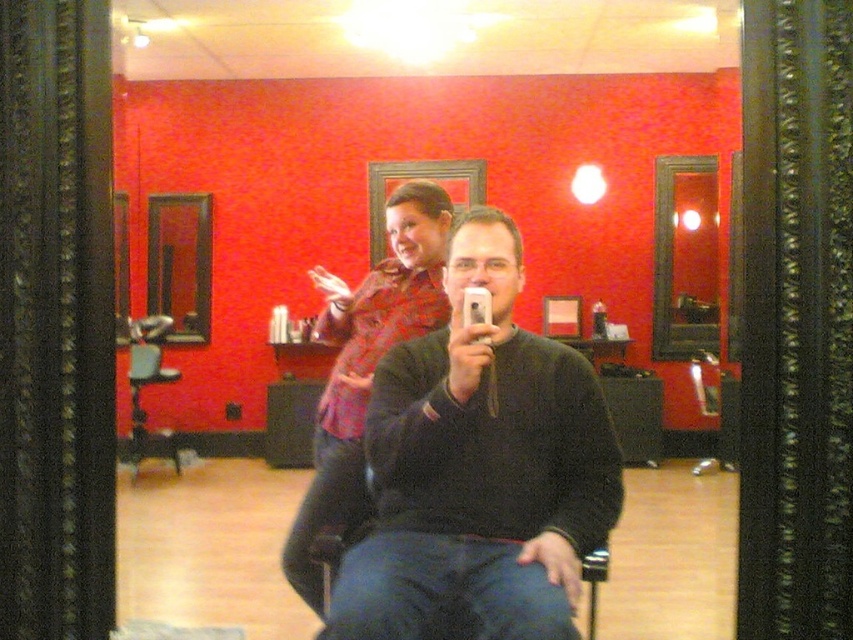
Question: Which object is closer to the camera taking this photo?

Choices:
 (A) matte black mirror at upper right
 (B) red plaid shirt at upper center
 (C) black matte sweater at center

Answer: (C)

Question: Estimate the real-world distances between objects in this image. Which object is closer to the black matte sweater at center?

Choices:
 (A) wooden frame mirror at left
 (B) matte black mirror at upper right

Answer: (B)

Question: Where is black matte sweater at center located in relation to red plaid shirt at upper center in the image?

Choices:
 (A) above
 (B) below

Answer: (B)

Question: Can you confirm if red plaid shirt at upper center is positioned below matte black mirror at upper right?

Choices:
 (A) yes
 (B) no

Answer: (A)

Question: Does red plaid shirt at upper center have a lesser width compared to wooden frame mirror at left?

Choices:
 (A) yes
 (B) no

Answer: (A)

Question: Among these objects, which one is farthest from the camera?

Choices:
 (A) wooden frame mirror at left
 (B) matte black mirror at upper right

Answer: (A)